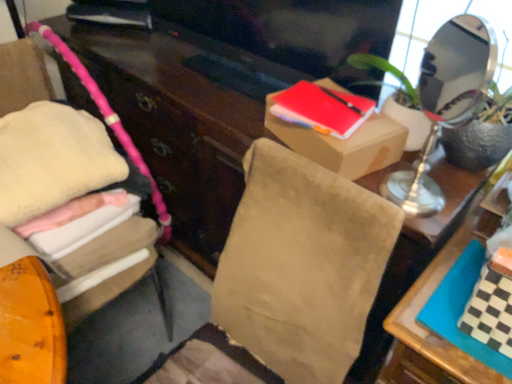
Identify the location of vacant area that lies to the right of green textured plant at upper right. This screenshot has width=512, height=384. (439, 190).